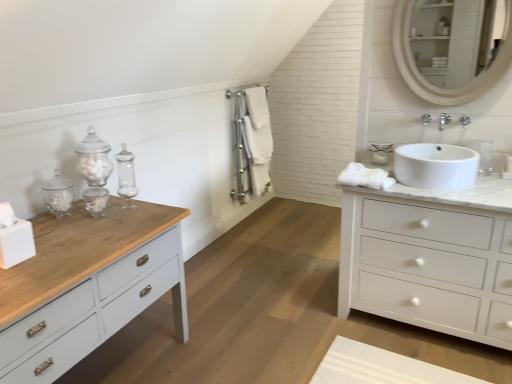
Question: From the image's perspective, is white cotton towel at center, the 2th bath towel in the right-to-left sequence, located above or below white glossy sink at right?

Choices:
 (A) below
 (B) above

Answer: (B)

Question: Would you say white cotton towel at center, the 2th bath towel in the right-to-left sequence, is to the left or to the right of white glossy sink at right in the picture?

Choices:
 (A) right
 (B) left

Answer: (B)

Question: Estimate the real-world distances between objects in this image. Which object is farther from the white cotton towel at center, the first bath towel from the back?

Choices:
 (A) white cotton bath towel at center, marked as the 1th bath towel in a left-to-right arrangement
 (B) white fluffy bath towel at right, which is counted as the 3th bath towel, starting from the back
 (C) white matte chest of drawers at right
 (D) white wooden mirror at upper right
 (E) white glossy sink at right

Answer: (C)

Question: Which is farther from the white matte chest of drawers at right?

Choices:
 (A) white cotton towel at center, the first bath towel from the back
 (B) white glossy sink at right
 (C) white fluffy bath towel at right, acting as the 1th bath towel starting from the right
 (D) white wooden mirror at upper right
 (E) white cotton bath towel at center, which appears as the 2th bath towel when viewed from the back

Answer: (A)